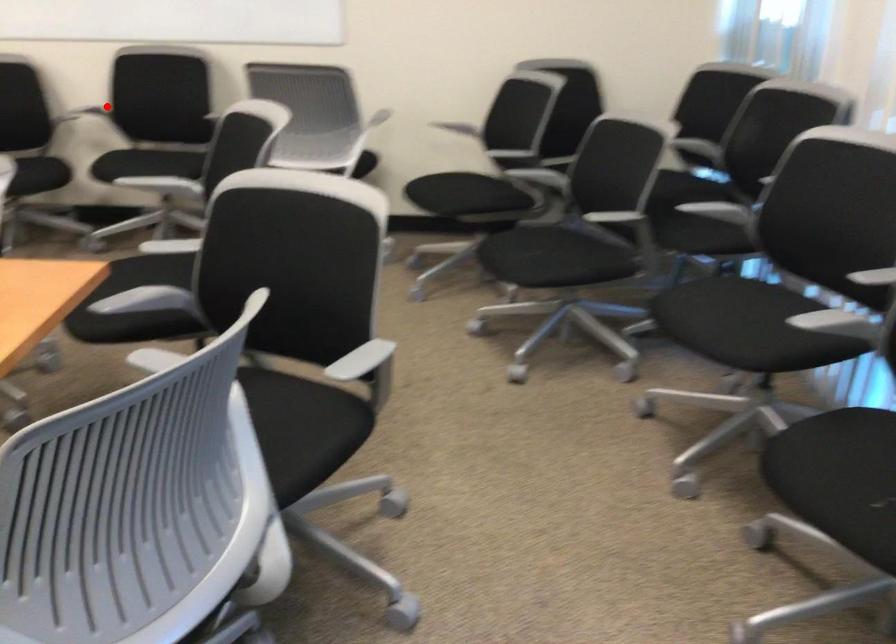
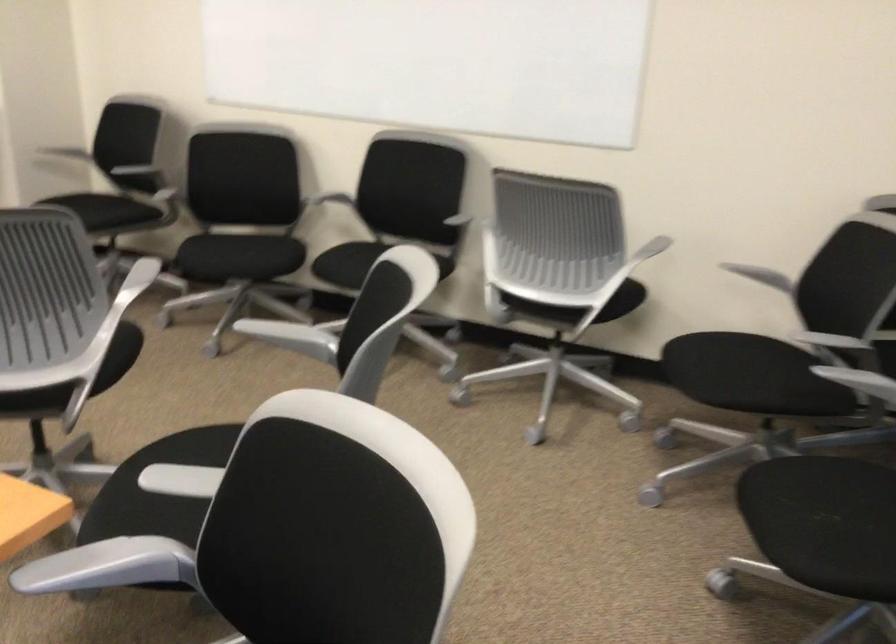
Find the pixel in the second image that matches the highlighted location in the first image.

(340, 196)